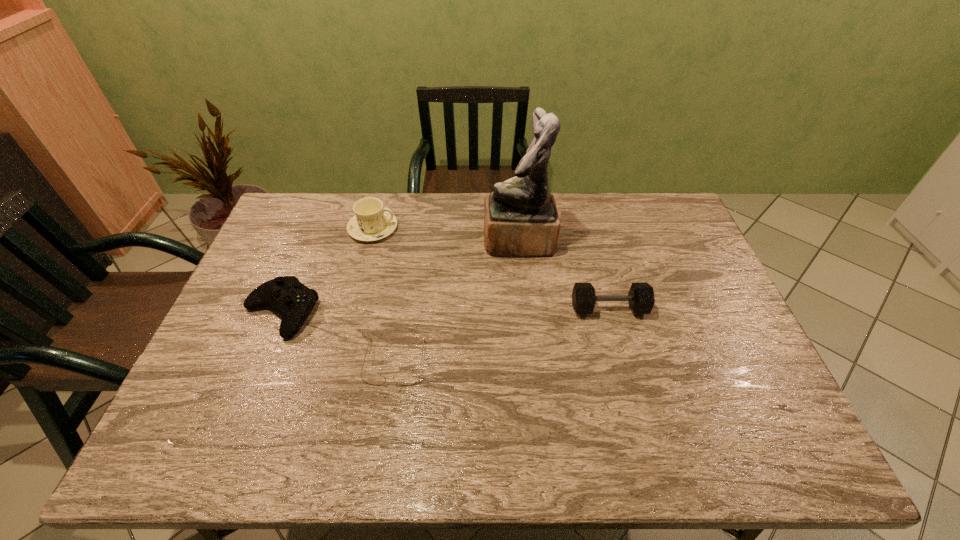
Identify the location of vacant space located 0.390m on the handle side of the chinaware. The height and width of the screenshot is (540, 960). (510, 228).

Where is `vacant space located 0.300m on the left of the dumbbell`? Image resolution: width=960 pixels, height=540 pixels. vacant space located 0.300m on the left of the dumbbell is located at coordinates [468, 308].

Locate an element on the screen. The width and height of the screenshot is (960, 540). vacant space located 0.190m on the front of the control is located at coordinates (243, 405).

The image size is (960, 540). I want to click on free space located on the front-facing side of the spectacles, so click(x=380, y=457).

Identify the location of sculpture that is positioned at the far edge. (521, 219).

Where is `chinaware that is positioned at the far edge`? The width and height of the screenshot is (960, 540). chinaware that is positioned at the far edge is located at coordinates (372, 221).

Where is `object at the left edge`? This screenshot has height=540, width=960. object at the left edge is located at coordinates (294, 301).

The height and width of the screenshot is (540, 960). Identify the location of free space at the far edge. (405, 206).

In the image, there is a desktop. Find the location of `vacant space at the near edge`. vacant space at the near edge is located at coordinates coord(549,464).

The width and height of the screenshot is (960, 540). Find the location of `vacant space at the left edge of the desktop`. vacant space at the left edge of the desktop is located at coordinates (274, 247).